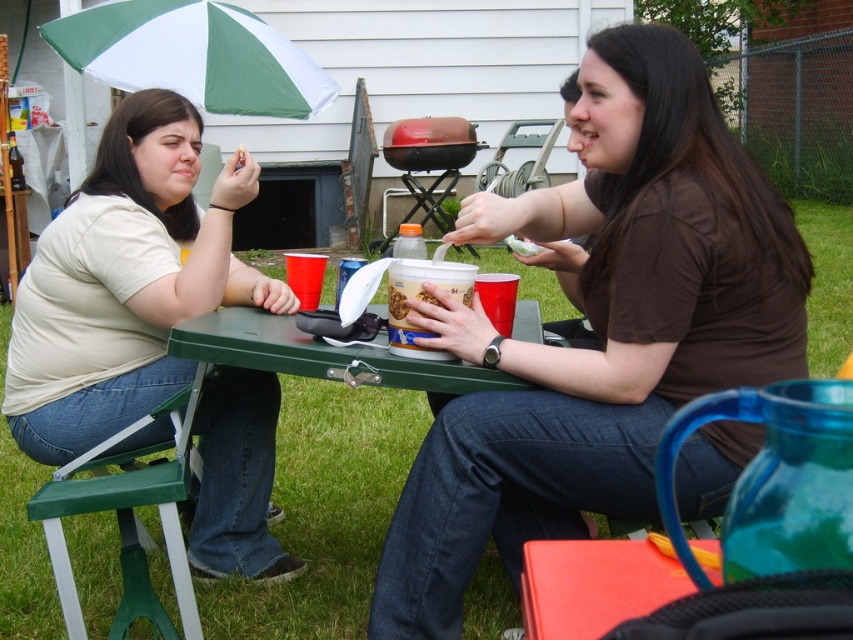
You are a photographer standing at the origin of a coordinate system. You want to take a photo of the matte beige shirt at left. What are the coordinates where you should aim your camera?

The coordinates to aim the camera are at point (125, 282).

You are trying to decide whether to place a large salad bowl on the green plastic picnic table at center. Considering the size of the brown matte shirt at center, will there be enough space?

The brown matte shirt at center is smaller than the green plastic picnic table at center, so there should be enough space to place the large salad bowl on the green plastic picnic table at center.

You are a photographer trying to capture a candid shot of the scene. You notice the brown matte shirt at center and the green plastic picnic table at center. Which object is positioned higher in the frame?

The brown matte shirt at center is located above the green plastic picnic table at center, so it is positioned higher in the frame.